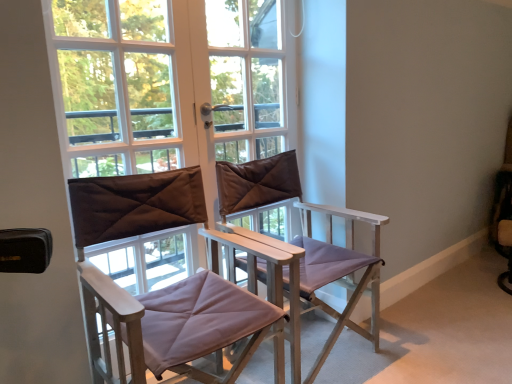
Question: Can you confirm if purple fabric chair at center, which is the 2th chair in left-to-right order, is smaller than transparent glass window at center?

Choices:
 (A) no
 (B) yes

Answer: (A)

Question: Is purple fabric chair at center, acting as the 1th chair starting from the right, closer to the viewer compared to transparent glass window at center?

Choices:
 (A) no
 (B) yes

Answer: (B)

Question: Considering the relative positions of purple fabric chair at center, acting as the 1th chair starting from the right, and transparent glass window at center in the image provided, is purple fabric chair at center, acting as the 1th chair starting from the right, to the right of transparent glass window at center from the viewer's perspective?

Choices:
 (A) no
 (B) yes

Answer: (B)

Question: Is purple fabric chair at center, which is the 2th chair in left-to-right order, not inside transparent glass window at center?

Choices:
 (A) yes
 (B) no

Answer: (A)

Question: From a real-world perspective, is purple fabric chair at center, acting as the 1th chair starting from the right, positioned under transparent glass window at center based on gravity?

Choices:
 (A) yes
 (B) no

Answer: (A)

Question: Based on their positions, is matte brown director's chair at center, the second chair in the right-to-left sequence, located to the left or right of purple fabric chair at center, acting as the 1th chair starting from the right?

Choices:
 (A) right
 (B) left

Answer: (B)

Question: Which is correct: matte brown director's chair at center, the second chair in the right-to-left sequence, is inside purple fabric chair at center, acting as the 1th chair starting from the right, or outside of it?

Choices:
 (A) inside
 (B) outside

Answer: (B)

Question: From the image's perspective, is matte brown director's chair at center, arranged as the 1th chair when viewed from the left, positioned above or below purple fabric chair at center, which is the 2th chair in left-to-right order?

Choices:
 (A) below
 (B) above

Answer: (A)

Question: Considering the positions of matte brown director's chair at center, arranged as the 1th chair when viewed from the left, and purple fabric chair at center, acting as the 1th chair starting from the right, in the image, is matte brown director's chair at center, arranged as the 1th chair when viewed from the left, wider or thinner than purple fabric chair at center, acting as the 1th chair starting from the right,?

Choices:
 (A) thin
 (B) wide

Answer: (A)

Question: In terms of width, does transparent glass window at center look wider or thinner when compared to matte brown director's chair at center, arranged as the 1th chair when viewed from the left?

Choices:
 (A) thin
 (B) wide

Answer: (A)

Question: From a real-world perspective, relative to matte brown director's chair at center, arranged as the 1th chair when viewed from the left, is transparent glass window at center vertically above or below?

Choices:
 (A) below
 (B) above

Answer: (B)

Question: Is transparent glass window at center taller or shorter than matte brown director's chair at center, arranged as the 1th chair when viewed from the left?

Choices:
 (A) short
 (B) tall

Answer: (B)

Question: Does point (86, 21) appear closer or farther from the camera than point (201, 215)?

Choices:
 (A) farther
 (B) closer

Answer: (B)

Question: Based on their sizes in the image, would you say transparent glass window at center is bigger or smaller than purple fabric chair at center, which is the 2th chair in left-to-right order?

Choices:
 (A) small
 (B) big

Answer: (A)

Question: Looking at their shapes, would you say transparent glass window at center is wider or thinner than purple fabric chair at center, which is the 2th chair in left-to-right order?

Choices:
 (A) thin
 (B) wide

Answer: (A)